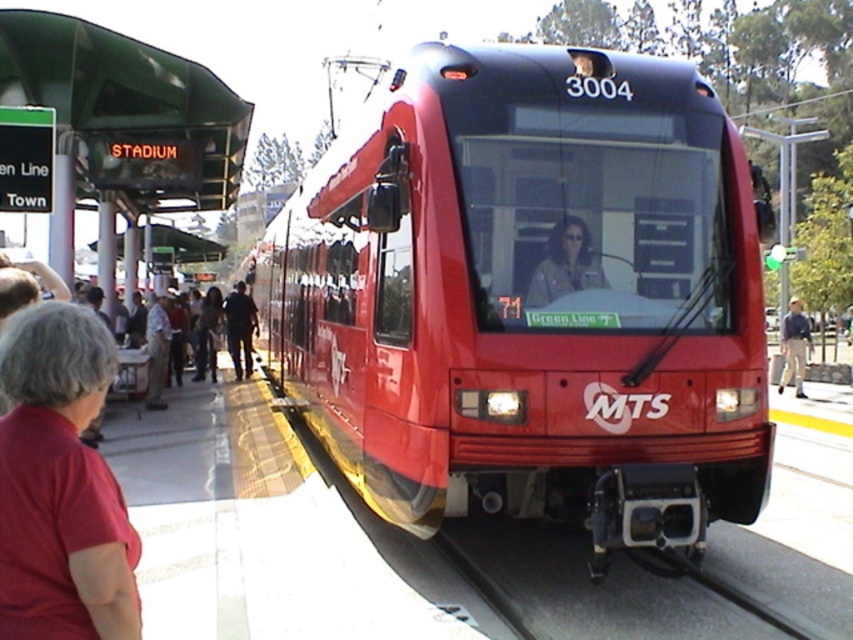
Between point (236, 369) and point (790, 353), which one is positioned behind?

The point (236, 369) is behind.

Locate an element on the screen. This screenshot has height=640, width=853. dark blue jeans at center is located at coordinates (241, 328).

Which is in front, point (239, 305) or point (792, 362)?

Point (792, 362)

Locate an element on the screen. The width and height of the screenshot is (853, 640). dark blue jeans at center is located at coordinates (241, 328).

Which of these two, glossy red train at center or blue denim jeans at right, stands taller?

Standing taller between the two is blue denim jeans at right.

Where is `glossy red train at center`? Image resolution: width=853 pixels, height=640 pixels. glossy red train at center is located at coordinates (x=525, y=294).

Who is more forward, (733, 497) or (784, 372)?

Point (733, 497) is more forward.

You are a GUI agent. You are given a task and a screenshot of the screen. Output one action in this format:
    pyautogui.click(x=<x>, y=<y>)
    Task: Click on the glossy red train at center
    
    Given the screenshot: What is the action you would take?
    pyautogui.click(x=525, y=294)

Which is behind, point (566, 228) or point (793, 385)?

The point (793, 385) is behind.

From the picture: Who is more distant from viewer, (590, 282) or (798, 380)?

Point (798, 380)

Find the location of `khaki fabric jacket at center`. khaki fabric jacket at center is located at coordinates (566, 264).